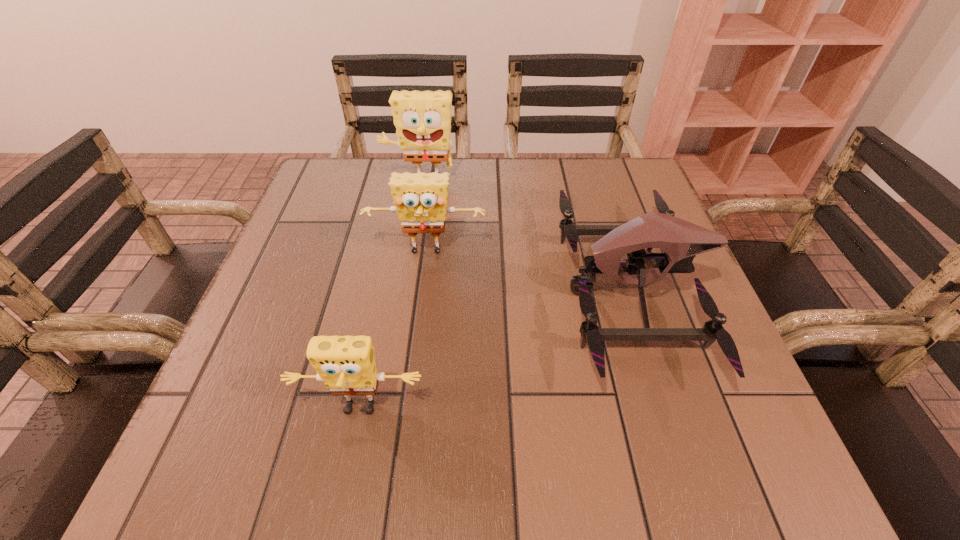
In order to click on free space that satisfies the following two spatial constraints: 1. on the front-facing side of the drone; 2. on the face of the nearest sponge in this screenshot , I will do `click(670, 409)`.